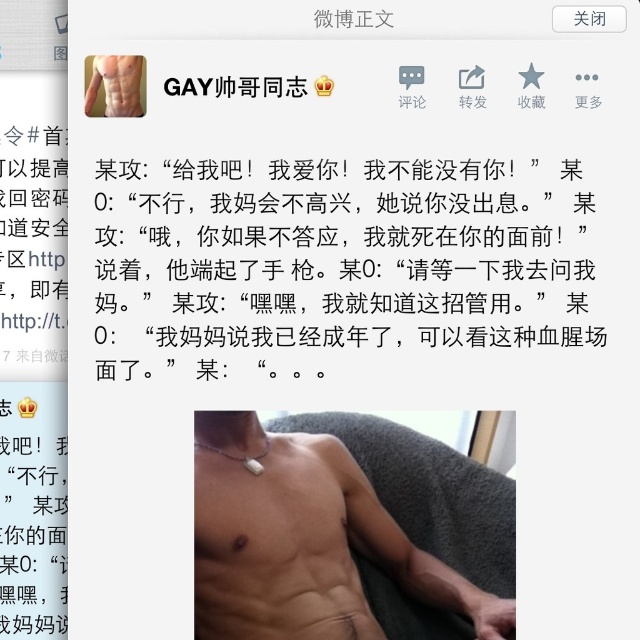
Question: Among these points, which one is nearest to the camera?

Choices:
 (A) (492, 161)
 (B) (305, 435)
 (C) (108, 72)

Answer: (C)

Question: Considering the relative positions of white matte text at upper center and matte silver necklace at center in the image provided, where is white matte text at upper center located with respect to matte silver necklace at center?

Choices:
 (A) right
 (B) left

Answer: (A)

Question: Does matte silver necklace at center have a lesser width compared to matte skin torso at upper center?

Choices:
 (A) yes
 (B) no

Answer: (B)

Question: Does white matte text at upper center have a smaller size compared to matte silver necklace at center?

Choices:
 (A) yes
 (B) no

Answer: (A)

Question: Which of the following is the closest to the observer?

Choices:
 (A) click(x=340, y=340)
 (B) click(x=346, y=611)
 (C) click(x=83, y=104)

Answer: (C)

Question: Which object is closer to the camera taking this photo?

Choices:
 (A) white matte text at upper center
 (B) matte silver necklace at center
 (C) matte skin torso at upper center

Answer: (C)